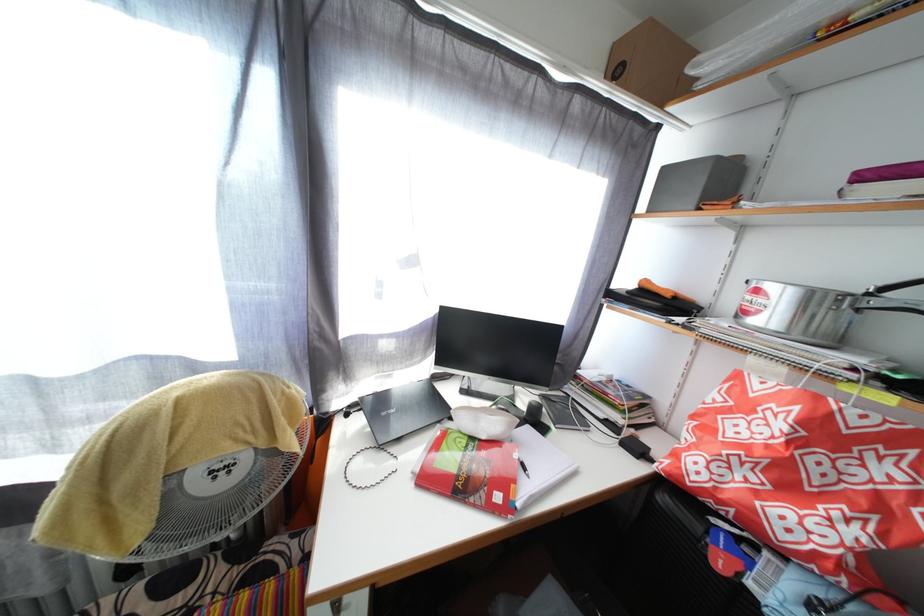
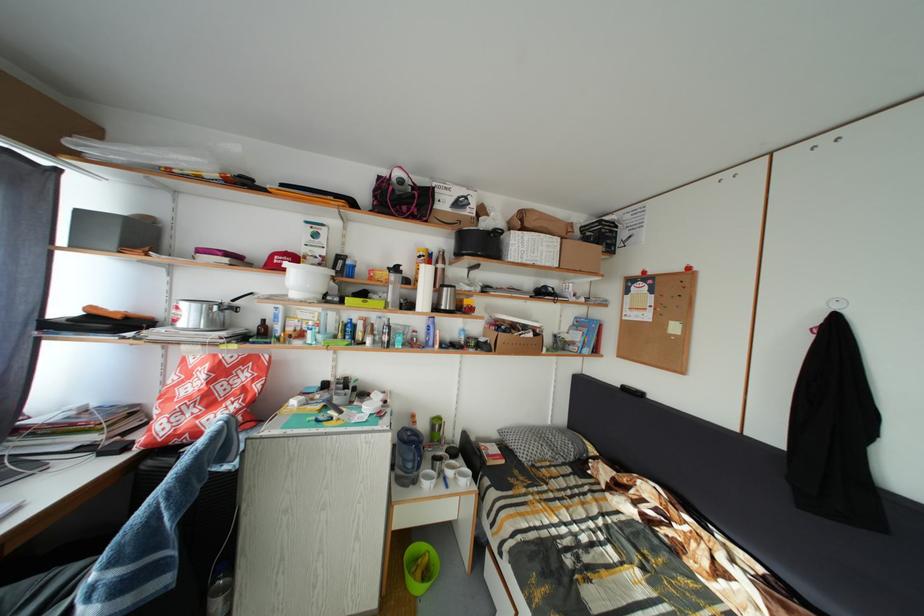
Question: How did the camera likely rotate?

Choices:
 (A) Left
 (B) Right
 (C) Up
 (D) Down

Answer: (B)